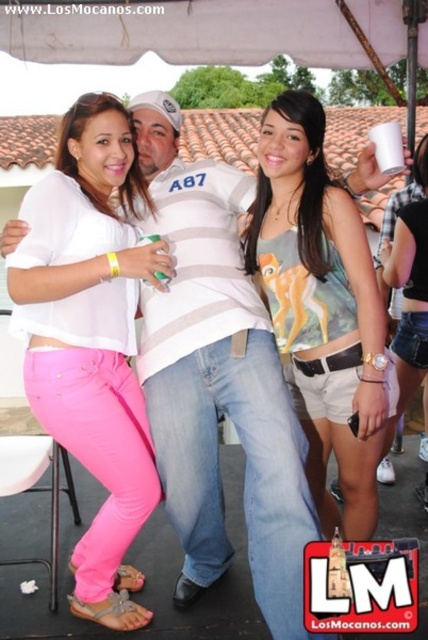
You are at a party and want to grab the green plastic cup at center to get a drink. However, there is a pink fabric stool at lower left in the way. Can you reach the cup without moving the stool?

The green plastic cup at center is behind the pink fabric stool at lower left, so you cannot reach it without moving the stool.

You are a photographer standing at a certain distance from the matte green tank top at center. If you want to take a closeup shot of it without moving the subject, what adjustment can you make to your camera?

You can zoom in using the camera lens to capture a closeup of the matte green tank top at center without moving closer since the distance between you and the matte green tank top at center is 2.42 meters.

You are standing at the point with coordinates point [321,301]. Looking at the image, which object from the following list is directly beneath you? The options are the green can held by the left person, the horizontally striped shirt with number A87, and the pink pants of the person on the left.

The point [321,301] is on matte green tank top at center, so the object directly beneath you is the horizontally striped shirt with number A87.